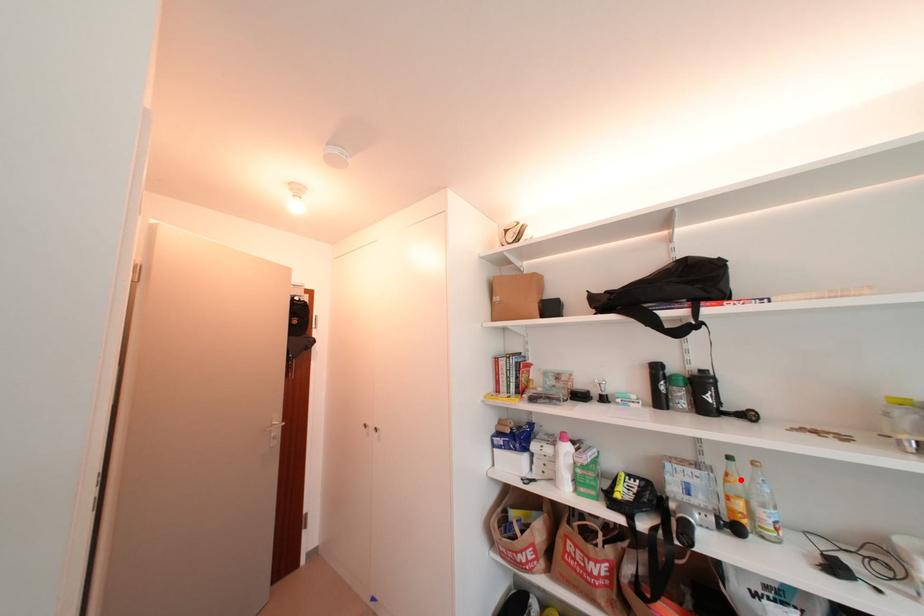
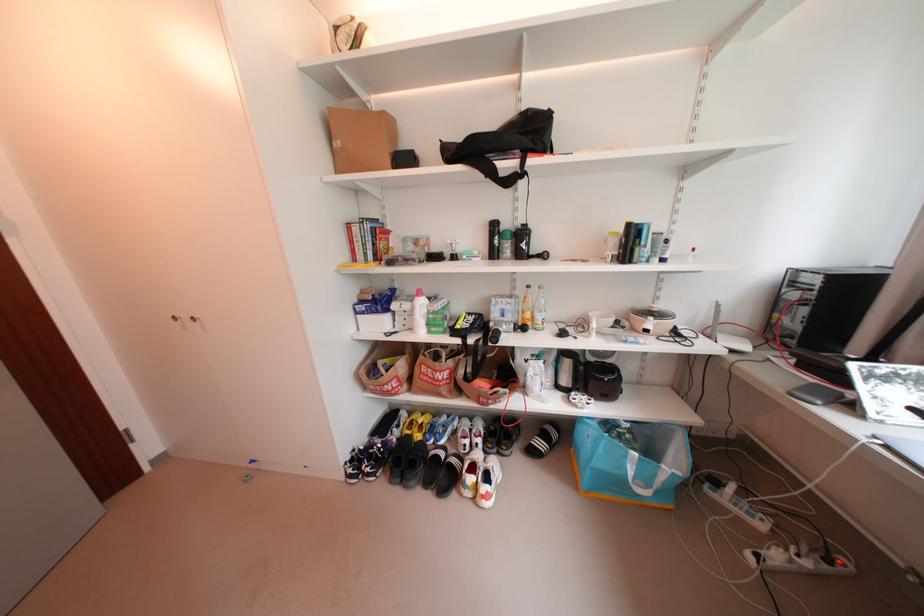
In the second image, find the point that corresponds to the highlighted location in the first image.

(536, 301)